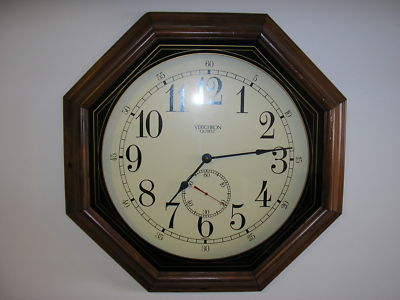
The width and height of the screenshot is (400, 300). I want to click on white wall, so click(x=45, y=208).